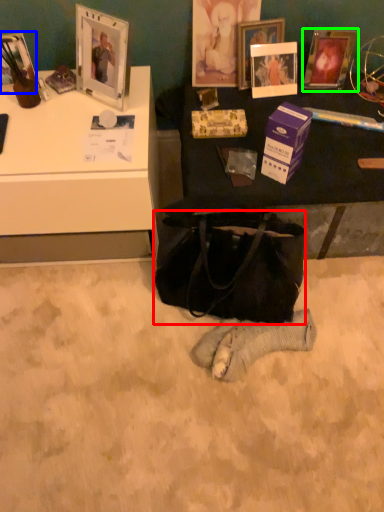
Question: Which object is the farthest from handbag (highlighted by a red box)? Choose among these: picture frame (highlighted by a blue box) or picture frame (highlighted by a green box).

Choices:
 (A) picture frame
 (B) picture frame

Answer: (A)